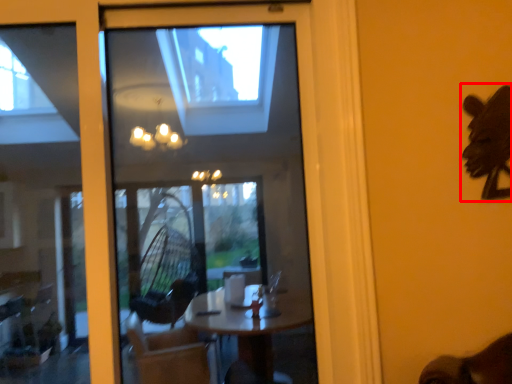
Question: From the image's perspective, considering the relative positions of animal (annotated by the red box) and window in the image provided, where is animal (annotated by the red box) located with respect to the staircase?

Choices:
 (A) above
 (B) below

Answer: (A)